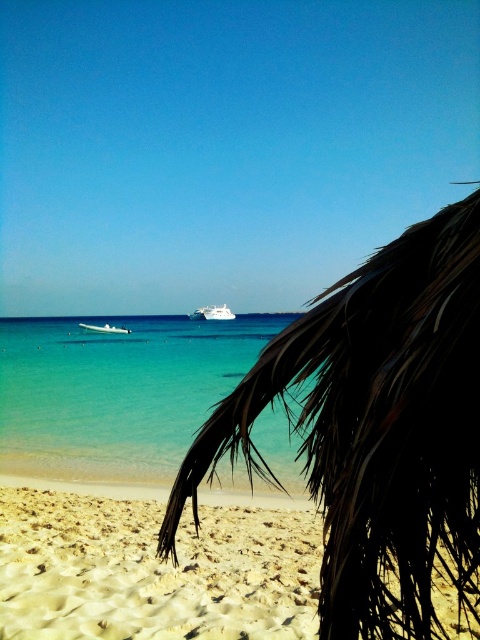
You are standing on the beige sandy beach at lower left and want to reach the clear blue water at center. Which direction should you move to get closer to the water?

Since the beige sandy beach at lower left is not as tall as the clear blue water at center, you should move towards the center direction to get closer to the water.

You are standing on the beach and see two points marked in the scene. The first point is at coordinate point(93, 397) and the second is at point(197, 316). Which point is closer to you?

Point(93, 397) is in front of point(197, 316), so it is closer to you.